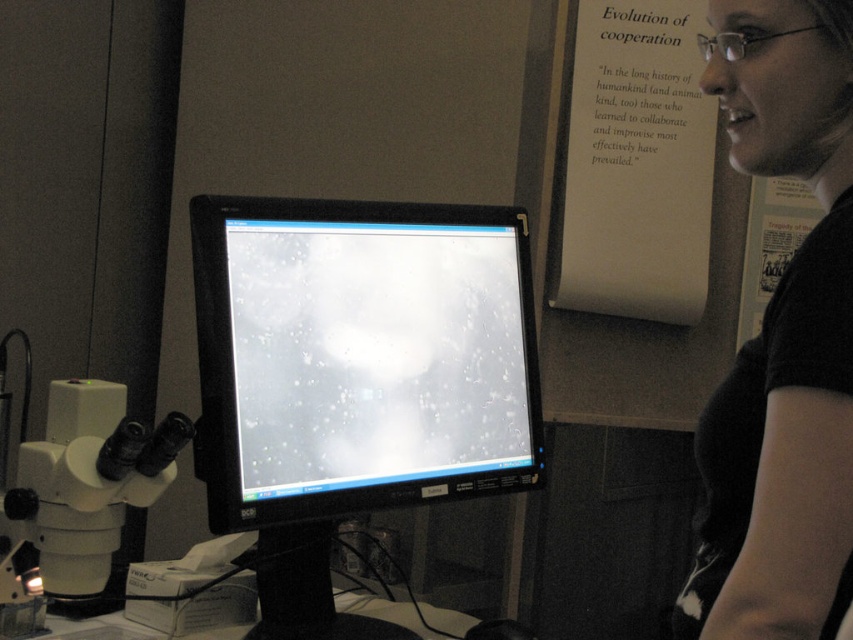
You are a researcher in the lab. You need to determine which of the two points, point (749, 627) or point (10, 509), is nearer to the camera. Which one is closer?

Point (749, 627) is closer to the camera than point (10, 509).